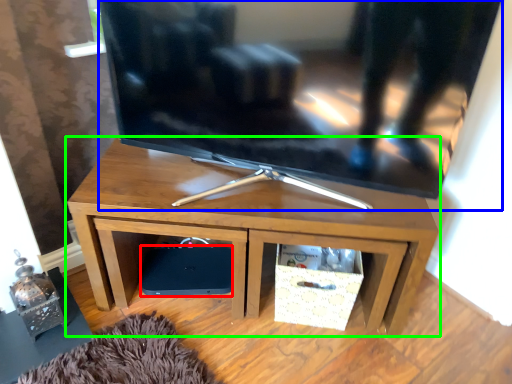
Question: Based on their relative distances, which object is nearer to speaker (highlighted by a red box)? Choose from television (highlighted by a blue box) and desk (highlighted by a green box).

Choices:
 (A) television
 (B) desk

Answer: (B)